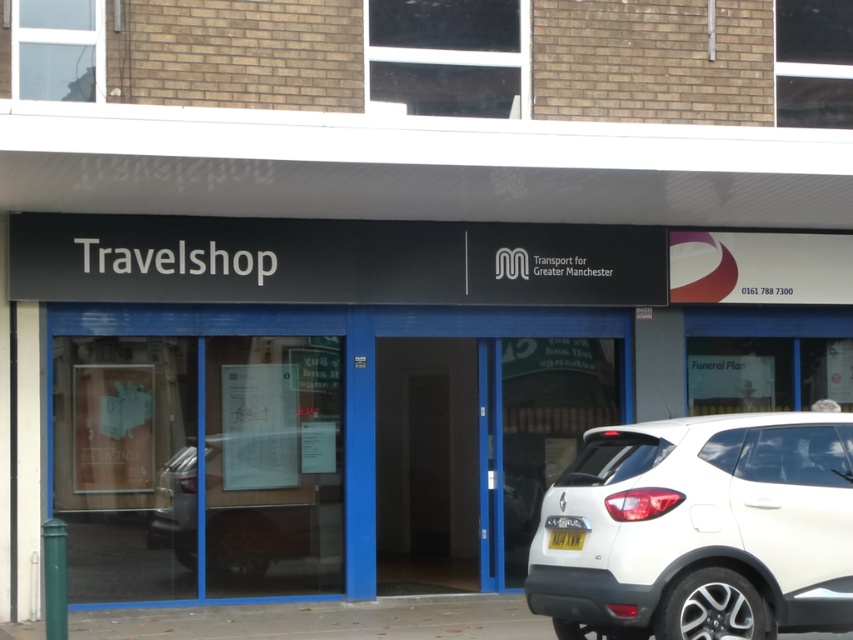
Question: Does blue glass door at center come in front of yellow plastic license plate at lower center?

Choices:
 (A) no
 (B) yes

Answer: (A)

Question: Which point is farther from the camera taking this photo?

Choices:
 (A) 288,554
 (B) 457,554

Answer: (B)

Question: Considering the real-world distances, which object is closest to the white glossy door at center?

Choices:
 (A) satin black suv at center
 (B) white matte suv at lower right
 (C) blue glass door at center
 (D) yellow plastic license plate at lower center

Answer: (A)

Question: Among these objects, which one is nearest to the camera?

Choices:
 (A) yellow plastic license plate at lower center
 (B) satin black suv at center

Answer: (A)

Question: Is white glossy door at center to the right of satin black suv at center from the viewer's perspective?

Choices:
 (A) no
 (B) yes

Answer: (B)

Question: Is white glossy door at center below satin black suv at center?

Choices:
 (A) yes
 (B) no

Answer: (A)